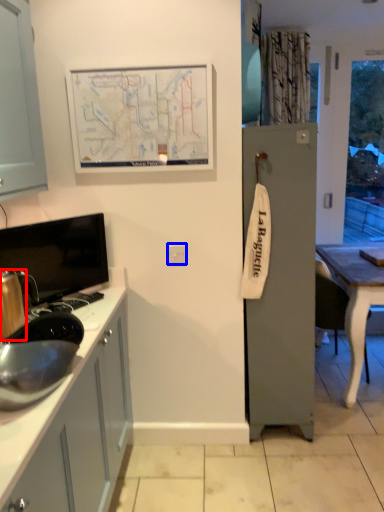
Question: Which point is closer to the camera, appliance (highlighted by a red box) or electric outlet (highlighted by a blue box)?

Choices:
 (A) appliance
 (B) electric outlet

Answer: (A)